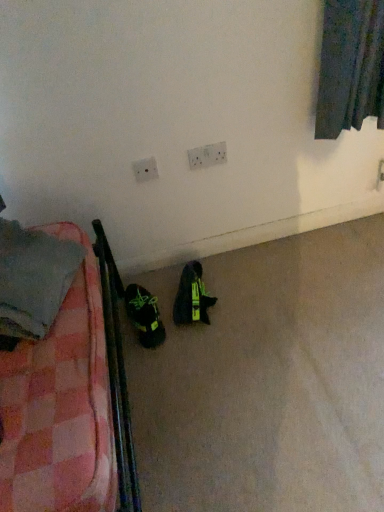
The width and height of the screenshot is (384, 512). Identify the location of vacant space behind green synthetic shoe at center, which appears as the second footwear when viewed from the left. (186, 263).